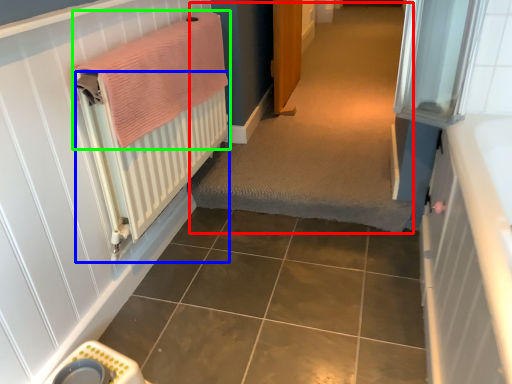
Question: Estimate the real-world distances between objects in this image. Which object is closer to plain (highlighted by a red box), radiator (highlighted by a blue box) or bath towel (highlighted by a green box)?

Choices:
 (A) radiator
 (B) bath towel

Answer: (A)